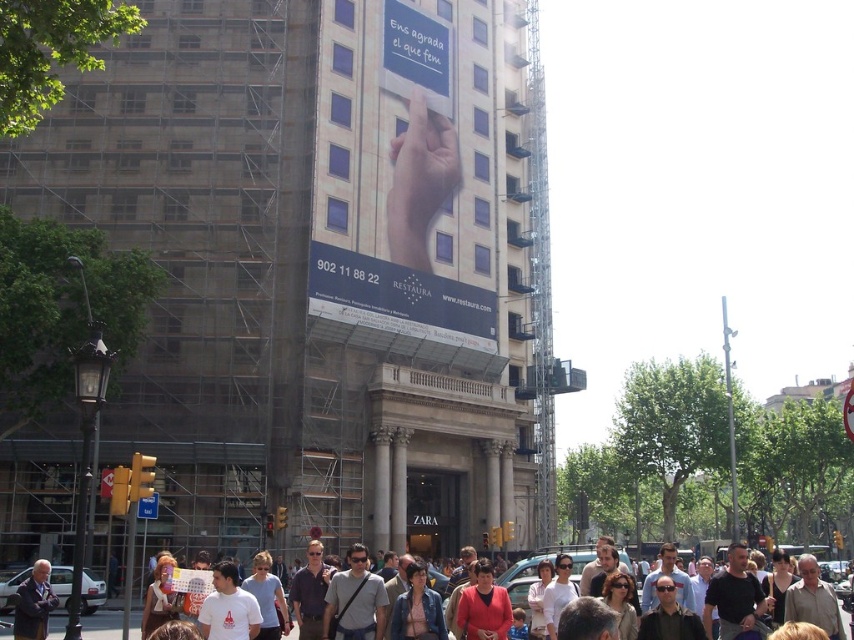
Is blue plastic signboard at center smaller than dark gray suit at lower left?

Incorrect, blue plastic signboard at center is not smaller in size than dark gray suit at lower left.

Does blue plastic signboard at center have a larger size compared to dark gray suit at lower left?

Yes.

Is point (369, 316) closer to viewer compared to point (42, 628)?

That is False.

Image resolution: width=854 pixels, height=640 pixels. What are the coordinates of `blue plastic signboard at center` in the screenshot? It's located at (399, 300).

Is point (439, 80) farther from viewer compared to point (45, 636)?

That is True.

Between white paper sign at upper center and dark gray suit at lower left, which one is positioned lower?

dark gray suit at lower left

Measure the distance between point [414,17] and camera.

Point [414,17] and camera are 74.12 meters apart.

Locate an element on the screen. Image resolution: width=854 pixels, height=640 pixels. white paper sign at upper center is located at coordinates (416, 54).

Is point (346, 282) more distant than point (706, 570)?

Yes.

Does blue plastic signboard at center have a larger size compared to white t-shirt at center?

No, blue plastic signboard at center is not bigger than white t-shirt at center.

The height and width of the screenshot is (640, 854). Identify the location of blue plastic signboard at center. (399, 300).

This screenshot has height=640, width=854. Find the location of `blue plastic signboard at center`. blue plastic signboard at center is located at coordinates (399, 300).